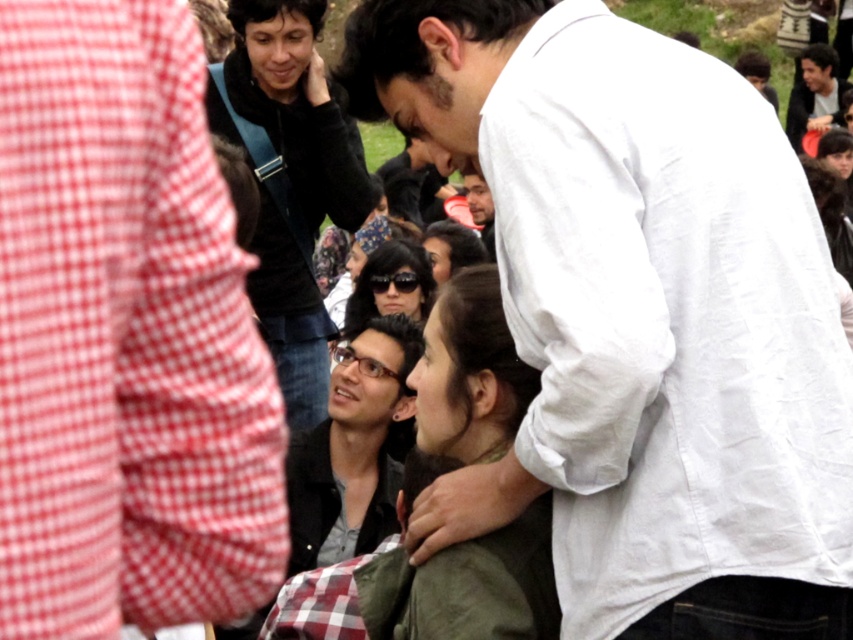
You are a photographer at the event and want to capture both the white cotton shirt at upper right and the matte black glasses at center in a single shot. However, you notice that one of the objects is partially blocking the other. Which object is blocking the other?

The white cotton shirt at upper right is positioned over matte black glasses at center, so the white cotton shirt at upper right is blocking the matte black glasses at center.

You are a photographer standing at the edge of the gathering. You want to capture a photo that includes both the white cotton shirt at upper right and the matte black glasses at center. Given that your camera has a maximum focus range of 6 meters, will you be able to include both subjects in the same frame without moving closer?

The white cotton shirt at upper right is 6.28 meters from the matte black glasses at center. Since the distance between them exceeds the camera maximum focus range of 6 meters, you won not be able to include both subjects in the same frame without moving closer.

Where is the white cotton shirt at upper right located in the image?

The white cotton shirt at upper right is located at point (639, 316).